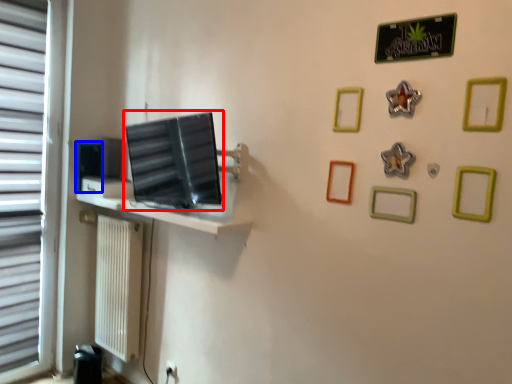
Question: Which of the following is the farthest to the observer, computer monitor (highlighted by a red box) or picture frame (highlighted by a blue box)?

Choices:
 (A) computer monitor
 (B) picture frame

Answer: (B)